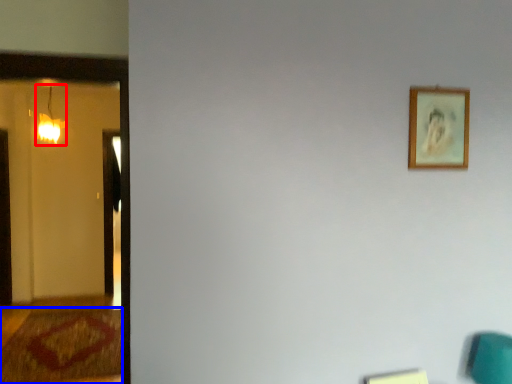
Question: Among these objects, which one is nearest to the camera, lamp (highlighted by a red box) or doormat (highlighted by a blue box)?

Choices:
 (A) lamp
 (B) doormat

Answer: (B)